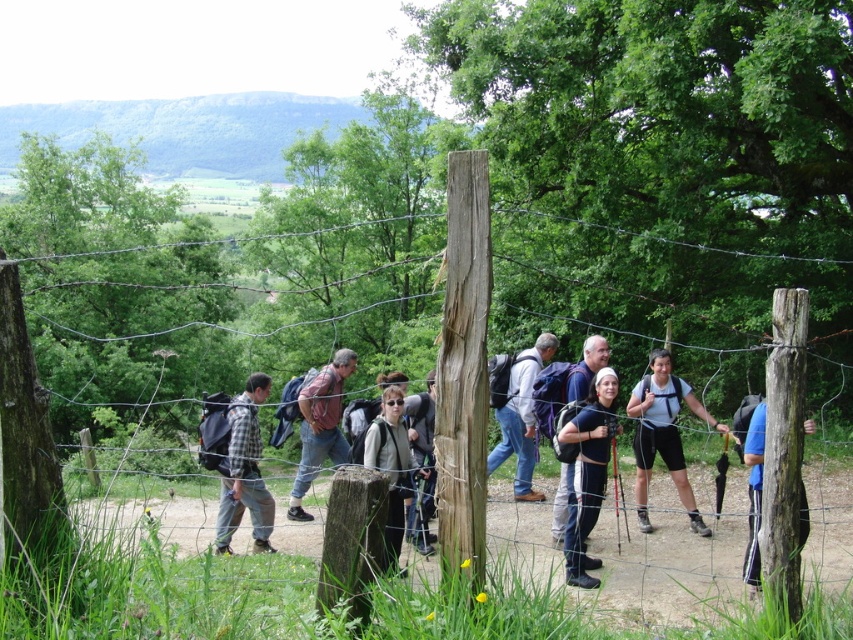
In the scene shown: You are a hiker looking at the scene. You see a black fabric backpack at center and a blue fabric backpack at right. Which backpack is positioned higher in the image?

The black fabric backpack at center is positioned higher than the blue fabric backpack at right in the image.

You are a hiker looking at the path ahead. You notice a matte black shorts at center and a rustic brown backpack at center. Which item is positioned to the right of the other?

The matte black shorts at center are to the right of the rustic brown backpack at center.